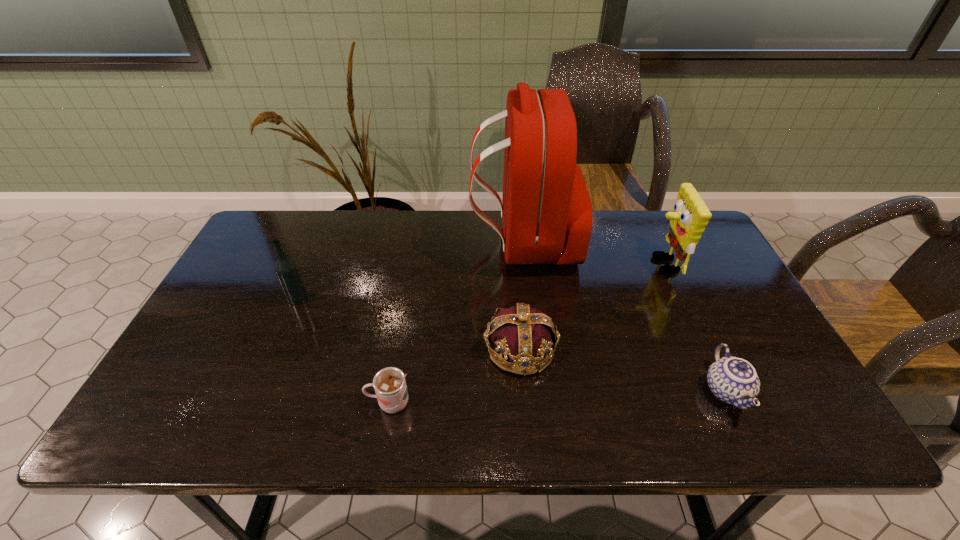
This screenshot has width=960, height=540. Find the location of `the second closest object relative to the chinaware`. the second closest object relative to the chinaware is located at coordinates (527, 337).

At what (x,y) coordinates should I click in order to perform the action: click on vacant area that satisfies the following two spatial constraints: 1. from the spout of the chinaware; 2. on the side with the handle of the cup. Please return your answer as a coordinate pair (x, y). The height and width of the screenshot is (540, 960). Looking at the image, I should click on (732, 403).

This screenshot has height=540, width=960. I want to click on free space that satisfies the following two spatial constraints: 1. on the strap side of the backpack; 2. on the front side of the third farthest object, so click(529, 299).

Locate an element on the screen. The image size is (960, 540). vacant space that satisfies the following two spatial constraints: 1. on the face of the second tallest object; 2. on the front side of the crown is located at coordinates (701, 349).

Find the location of a particular element. vacant region that satisfies the following two spatial constraints: 1. on the face of the second tallest object; 2. on the front side of the fourth tallest object is located at coordinates (701, 349).